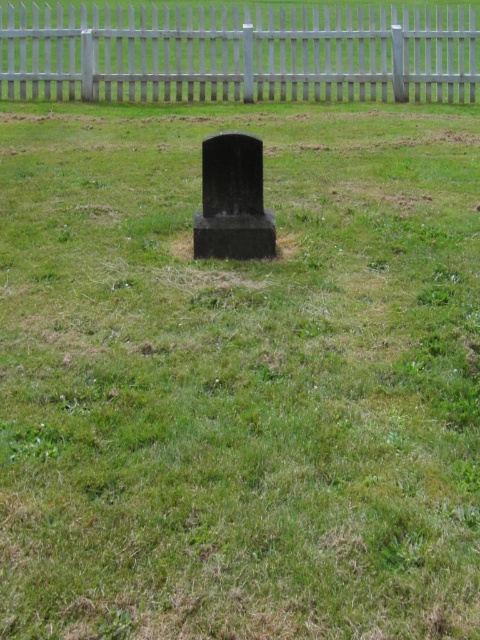
Question: Which of the following is the farthest from the observer?

Choices:
 (A) (240, 204)
 (B) (69, 48)

Answer: (B)

Question: Is white wooden fence at upper center to the left of black polished stone gravestone at center from the viewer's perspective?

Choices:
 (A) yes
 (B) no

Answer: (A)

Question: Is white wooden fence at upper center thinner than black polished stone gravestone at center?

Choices:
 (A) yes
 (B) no

Answer: (A)

Question: Does white wooden fence at upper center have a lesser width compared to black polished stone gravestone at center?

Choices:
 (A) yes
 (B) no

Answer: (A)